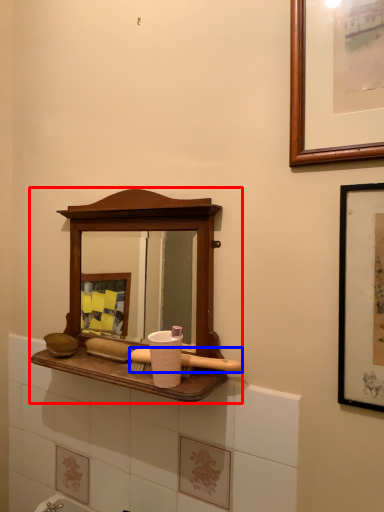
Question: Which point is closer to the camera, medicine cabinet (highlighted by a red box) or brush (highlighted by a blue box)?

Choices:
 (A) medicine cabinet
 (B) brush

Answer: (A)